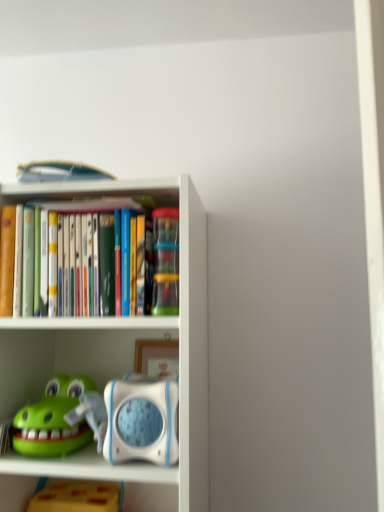
Question: Does point (173, 237) appear closer or farther from the camera than point (190, 238)?

Choices:
 (A) farther
 (B) closer

Answer: (A)

Question: Choose the correct answer: Is translucent plastic containers at center, positioned as the 3th toy in bottom-to-top order, inside white plastic shelf at center or outside it?

Choices:
 (A) outside
 (B) inside

Answer: (B)

Question: Which of these objects is positioned closest to the white plastic shelf at center?

Choices:
 (A) yellow matte block at lower left, which is counted as the third toy, starting from the top
 (B) green rubber toy at lower left, which is counted as the second toy, starting from the bottom
 (C) translucent plastic containers at center, positioned as the 3th toy in bottom-to-top order

Answer: (B)

Question: Which is nearer to the white plastic shelf at center?

Choices:
 (A) green rubber toy at lower left, acting as the second toy starting from the top
 (B) yellow matte block at lower left, which is counted as the third toy, starting from the top
 (C) translucent plastic containers at center, the 1th toy when ordered from top to bottom

Answer: (A)